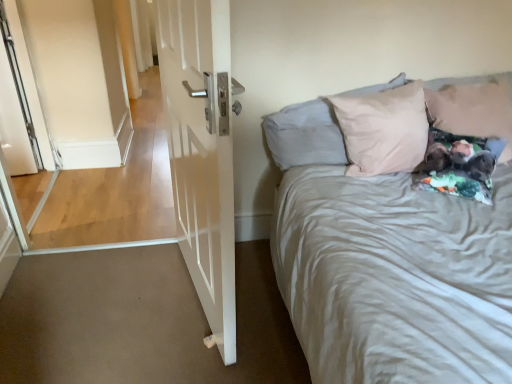
At what (x,y) coordinates should I click in order to perform the action: click on spots to the right of white glossy door at left. Please return your answer as a coordinate pair (x, y). Image resolution: width=512 pixels, height=384 pixels. Looking at the image, I should click on (259, 305).